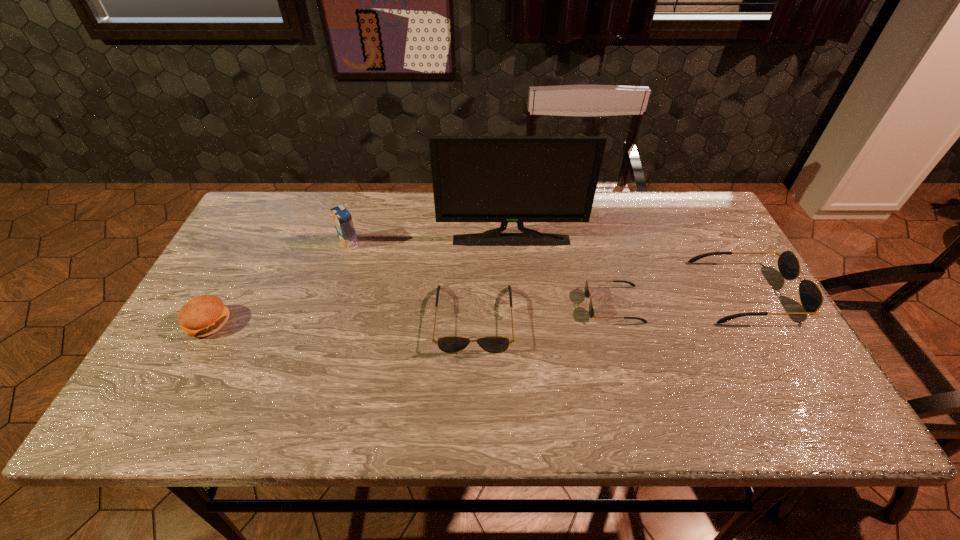
The sunglassess are evenly distributed in the image. To maintain this, where would you place another sunglasses on the left? Please point to a free space. Please provide its 2D coordinates. Your answer should be formatted as a tuple, i.e. [(x, y)], where the tuple contains the x and y coordinates of a point satisfying the conditions above.

[(325, 333)]